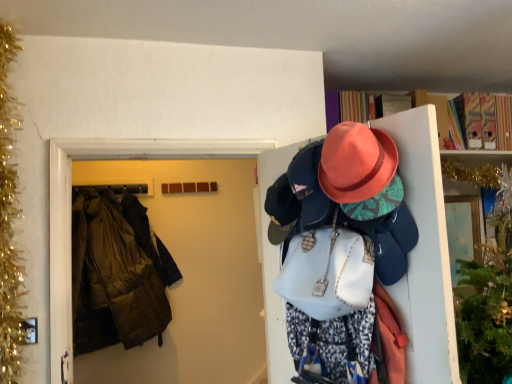
Question: From a real-world perspective, relative to dark brown leather jacket at left, is matte pink hat at upper right vertically above or below?

Choices:
 (A) below
 (B) above

Answer: (A)

Question: Considering the positions of matte pink hat at upper right and dark brown leather jacket at left in the image, is matte pink hat at upper right wider or thinner than dark brown leather jacket at left?

Choices:
 (A) wide
 (B) thin

Answer: (A)

Question: Considering the real-world distances, which object is closest to the gold tinsel garland at left?

Choices:
 (A) dark brown leather jacket at left
 (B) matte pink hat at upper right
 (C) brown fabric coat at left

Answer: (C)

Question: Estimate the real-world distances between objects in this image. Which object is farther from the matte pink hat at upper right?

Choices:
 (A) dark brown leather jacket at left
 (B) gold tinsel garland at left
 (C) brown fabric coat at left

Answer: (B)